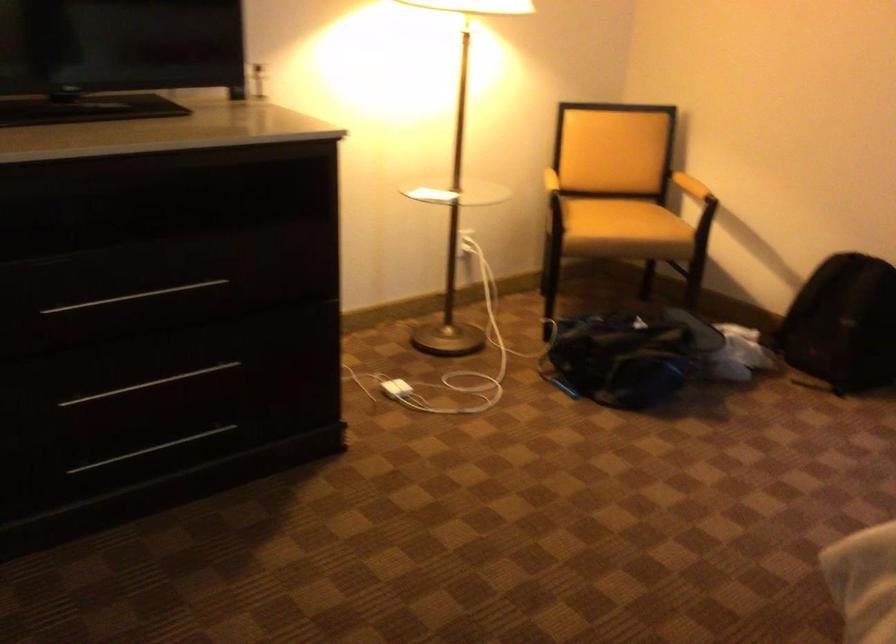
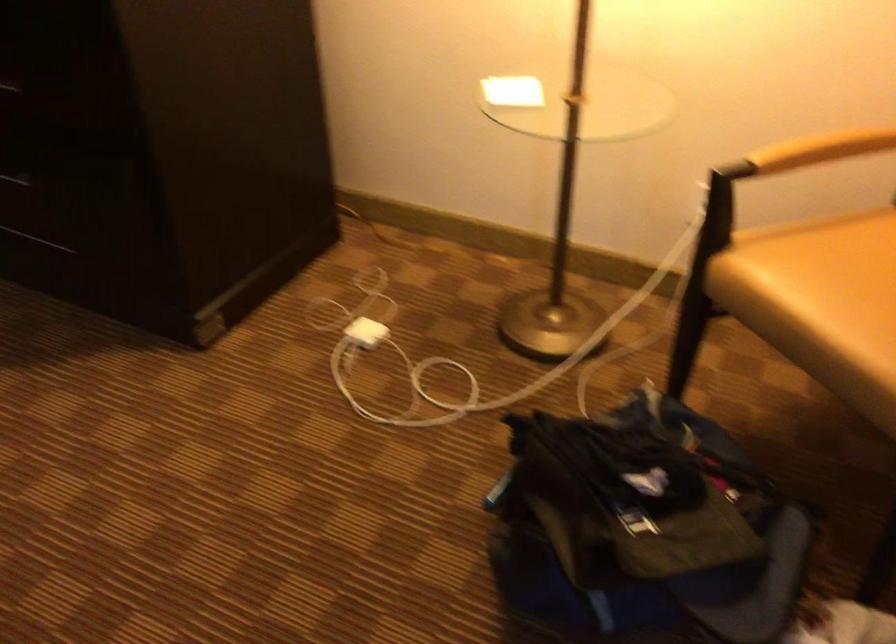
Locate, in the second image, the point that corresponds to (x=621, y=225) in the first image.

(821, 303)